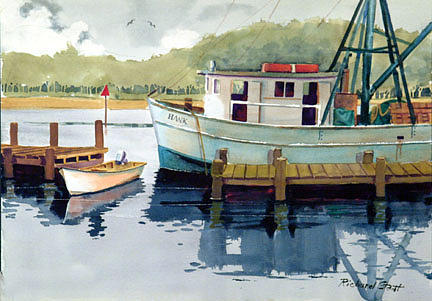
You are a GUI agent. You are given a task and a screenshot of the screen. Output one action in this format:
    pyautogui.click(x=<x>, y=<y>)
    Task: Click on the room
    
    Given the screenshot: What is the action you would take?
    pyautogui.click(x=241, y=98), pyautogui.click(x=307, y=104)